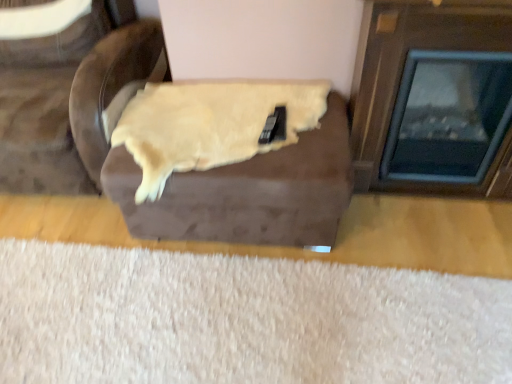
Where is `free space above brown suede ottoman at center, the second furniture in the left-to-right sequence (from a real-world perspective)`? The width and height of the screenshot is (512, 384). free space above brown suede ottoman at center, the second furniture in the left-to-right sequence (from a real-world perspective) is located at coordinates (257, 148).